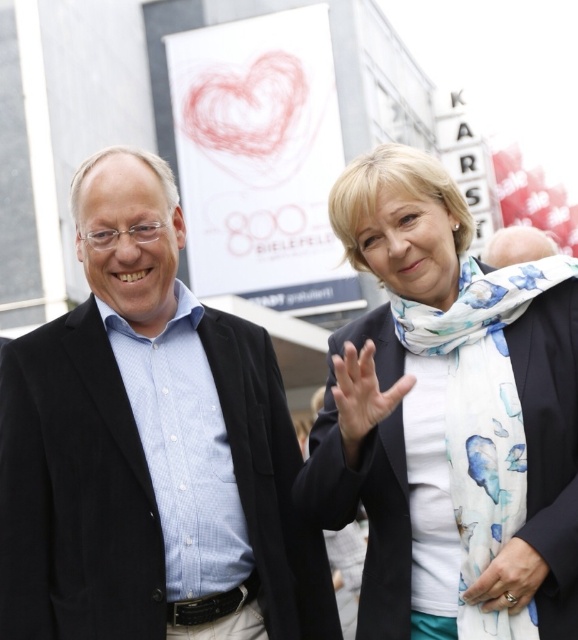
Between white floral scarf at upper center and gold ring at center, which one appears on the right side from the viewer's perspective?

From the viewer's perspective, gold ring at center appears more on the right side.

Does white floral scarf at upper center have a smaller size compared to gold ring at center?

No.

Which is behind, point (353, 388) or point (516, 545)?

The point (353, 388) is behind.

Identify the location of white floral scarf at upper center. The width and height of the screenshot is (578, 640). click(361, 394).

What are the coordinates of `white floral scarf at upper center` in the screenshot? It's located at (361, 394).

Between point (361, 358) and point (513, 236), which one is positioned in front?

Positioned in front is point (361, 358).

Who is more forward, (331,392) or (535,243)?

Point (331,392) is in front.

Find the location of a particular element. This screenshot has height=640, width=578. white floral scarf at upper center is located at coordinates (361, 394).

Who is more distant from viewer, (294, 442) or (355, 358)?

The point (294, 442) is more distant.

Does blue shirt at center have a greater width compared to white floral scarf at upper center?

Yes.

Identify the location of blue shirt at center. The image size is (578, 640). (146, 442).